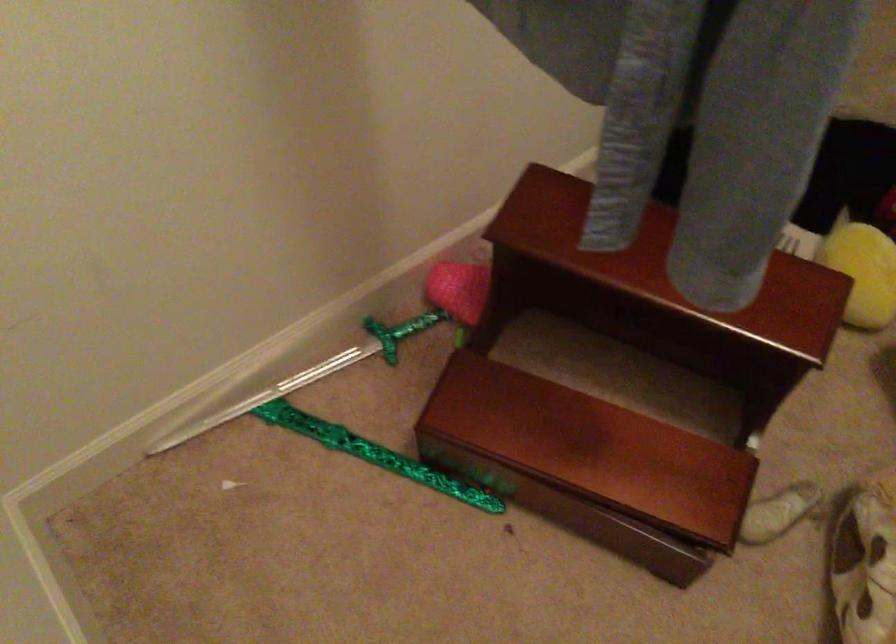
Find where to pull the wooden drawer. Please return your answer as a coordinate pair (x, y).

(621, 384)